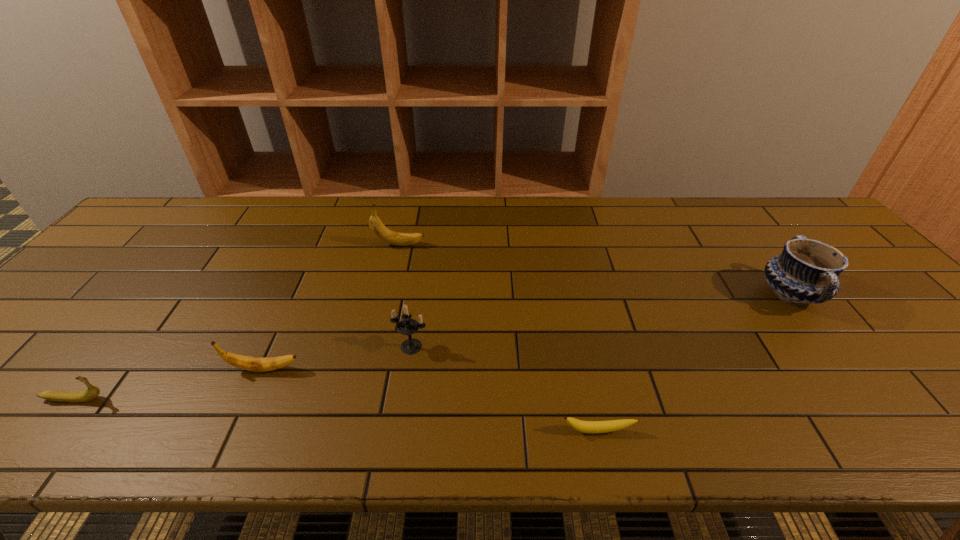
Identify the location of free point between the leftmost object and the pottery. This screenshot has height=540, width=960. (432, 347).

This screenshot has width=960, height=540. What are the coordinates of `free point between the candle holder and the farthest object` in the screenshot? It's located at (405, 295).

This screenshot has height=540, width=960. Find the location of `vacant area that lies between the rightmost object and the third nearest object`. vacant area that lies between the rightmost object and the third nearest object is located at coordinates (527, 332).

Where is `vacant space that is in between the rightmost object and the second farthest banana`? The image size is (960, 540). vacant space that is in between the rightmost object and the second farthest banana is located at coordinates pyautogui.click(x=527, y=332).

Where is `free space between the rightmost object and the shortest banana`? free space between the rightmost object and the shortest banana is located at coordinates (694, 362).

Find the location of `vacant area that lies between the pottery and the second farthest banana`. vacant area that lies between the pottery and the second farthest banana is located at coordinates (527, 332).

Locate an element on the screen. free space between the pottery and the rightmost banana is located at coordinates (694, 362).

Where is `vacant point located between the candle holder and the nearest object`? This screenshot has width=960, height=540. vacant point located between the candle holder and the nearest object is located at coordinates (505, 389).

Identify the location of free spot between the farthest object and the third farthest object. (405, 295).

You are a GUI agent. You are given a task and a screenshot of the screen. Output one action in this format:
    pyautogui.click(x=<x>, y=<y>)
    Task: Click on the vacant space that is in between the third farthest object and the second object from right to left
    This screenshot has height=540, width=960.
    Given the screenshot: What is the action you would take?
    pyautogui.click(x=505, y=389)